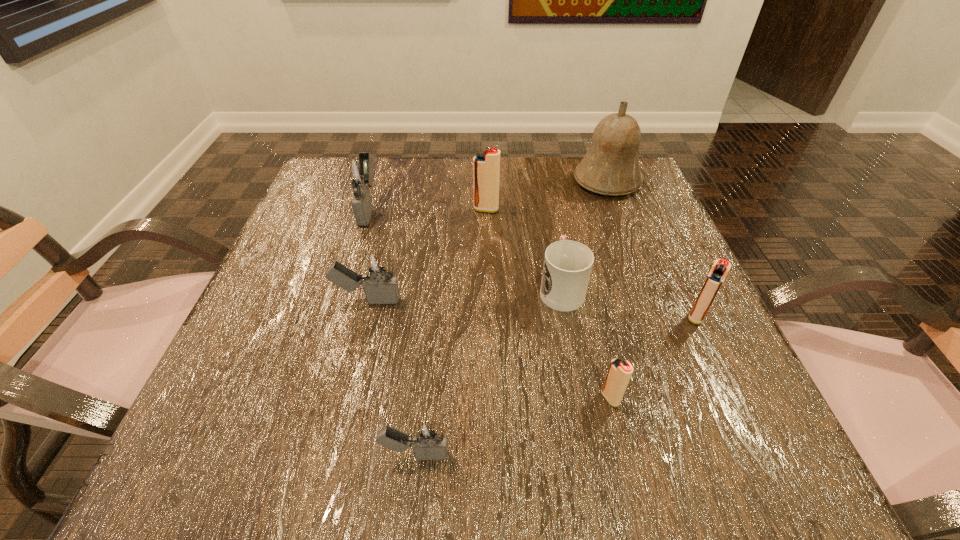
You are a GUI agent. You are given a task and a screenshot of the screen. Output one action in this format:
    pyautogui.click(x=<x>, y=<y>)
    Task: Click on the tallest object
    This screenshot has height=540, width=960.
    Given the screenshot: What is the action you would take?
    pyautogui.click(x=610, y=167)

At what (x,y) coordinates should I click in order to perform the action: click on the farthest red igniter. Please return your answer as a coordinate pair (x, y). This screenshot has width=960, height=540. Looking at the image, I should click on (486, 166).

Locate an element on the screen. This screenshot has height=540, width=960. the leftmost red igniter is located at coordinates (486, 166).

Identify the location of the farthest gray igniter. Image resolution: width=960 pixels, height=540 pixels. click(x=356, y=172).

The image size is (960, 540). Identify the location of the second smallest gray igniter. (381, 287).

Locate an element on the screen. the second nearest red igniter is located at coordinates (721, 267).

In order to click on the rightmost red igniter in this screenshot , I will do `click(721, 267)`.

Locate an element on the screen. cup is located at coordinates (567, 266).

Locate an element on the screen. the second nearest igniter is located at coordinates (619, 373).

This screenshot has height=540, width=960. In order to click on the second red igniter from right to left in this screenshot , I will do `click(619, 373)`.